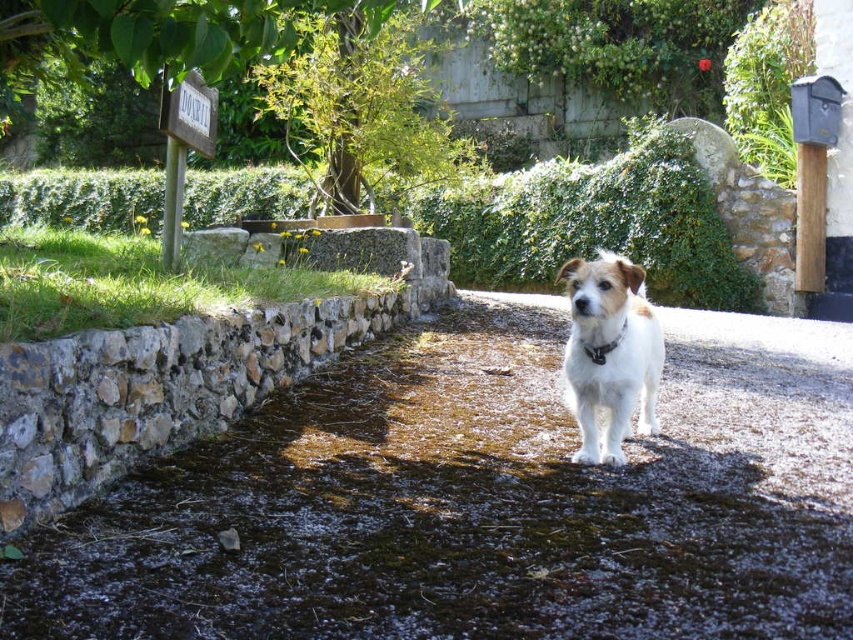
Question: Which point is closer to the camera taking this photo?

Choices:
 (A) tap(611, 342)
 (B) tap(610, 326)

Answer: (B)

Question: Which point appears closest to the camera in this image?

Choices:
 (A) (376, 358)
 (B) (585, 348)
 (C) (578, 458)

Answer: (B)

Question: Which object is farther from the camera taking this photo?

Choices:
 (A) white fur dog at center
 (B) brown stone path at center
 (C) black leather neckband at center

Answer: (C)

Question: Considering the relative positions of brown stone path at center and white fur dog at center in the image provided, where is brown stone path at center located with respect to white fur dog at center?

Choices:
 (A) right
 (B) left

Answer: (B)

Question: Is brown stone path at center smaller than black leather neckband at center?

Choices:
 (A) yes
 (B) no

Answer: (B)

Question: Does brown stone path at center appear on the right side of white fur dog at center?

Choices:
 (A) no
 (B) yes

Answer: (A)